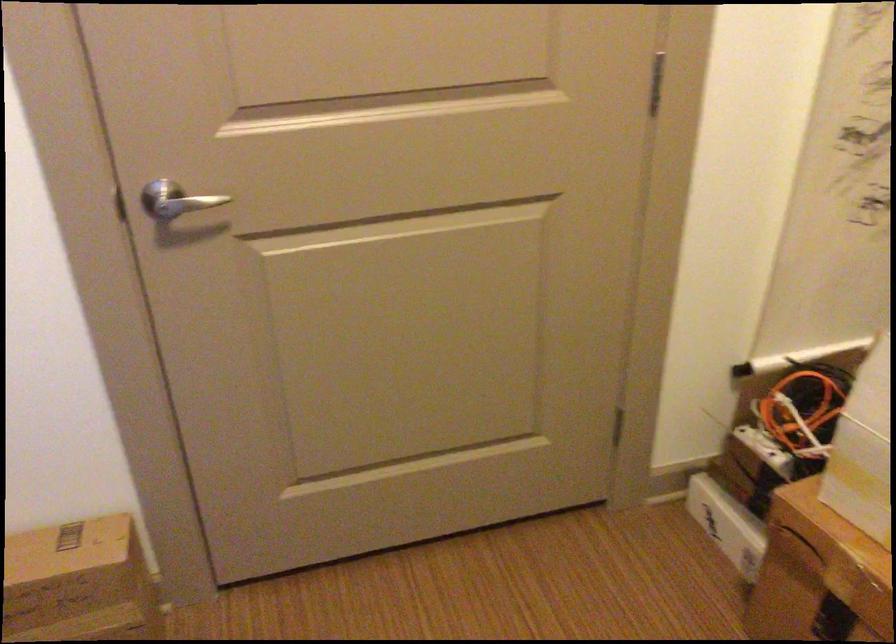
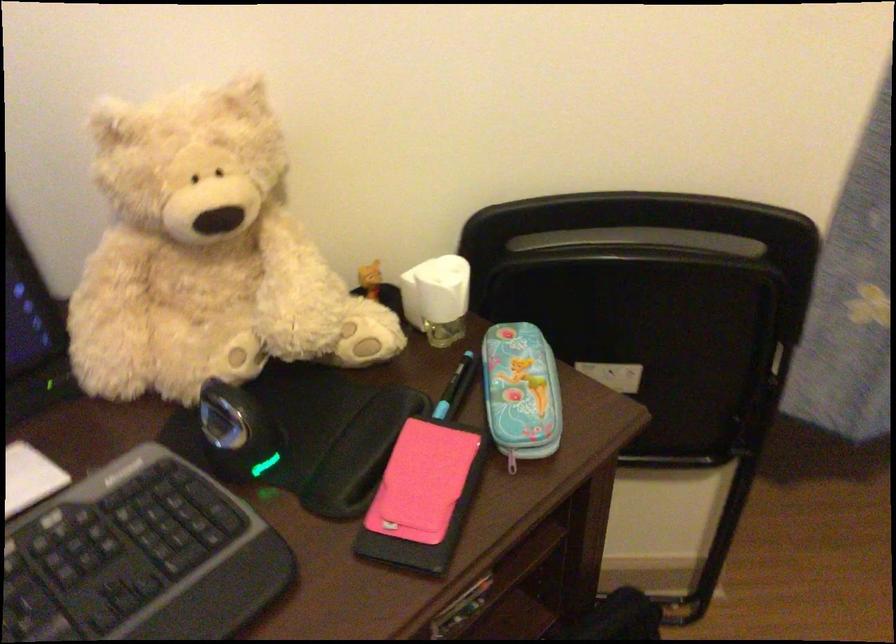
The first image is from the beginning of the video and the second image is from the end. How did the camera likely rotate when shooting the video?

The camera rotated toward left-down.